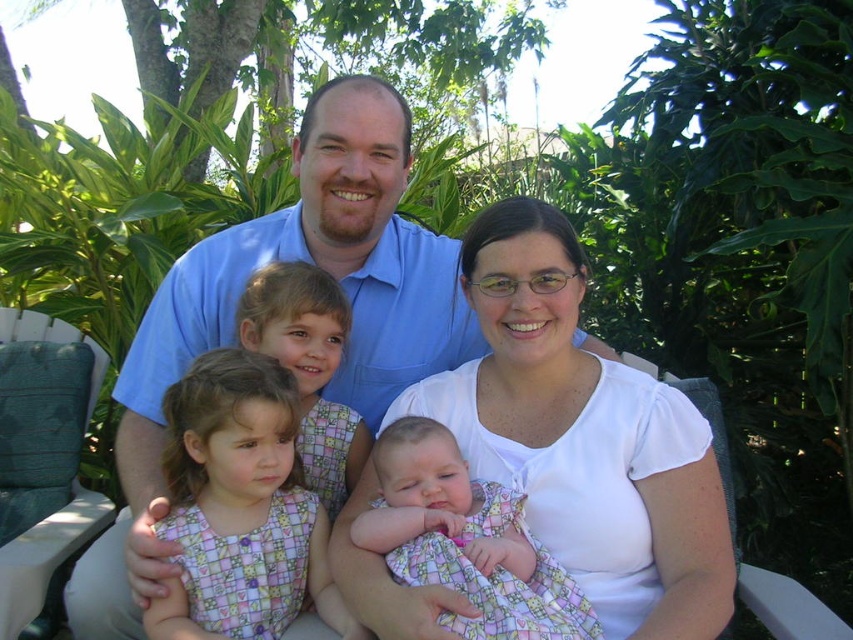
The image shows a family of five seated outdoors. The adults are sitting behind the children. There is a baby in the scene. Where is the floral fabric baby at center located in the image?

The floral fabric baby at center is located at point [465,540] in the image.

You are a photographer setting up for a family portrait. You need to ensure that the white cotton shirt at center and the plaid fabric dress at lower left are both visible in the frame. Based on their widths, which object should you prioritize positioning closer to the center of the frame to ensure visibility?

The white cotton shirt at center might be wider than plaid fabric dress at lower left, so prioritizing the white cotton shirt at center closer to the center of the frame ensures its visibility due to its potential larger width.

You are standing 5 feet away from the white cotton shirt at center. Can you reach it without moving your feet?

The white cotton shirt at center is 4.38 feet away from the viewer. Since you are standing 5 feet away, you cannot reach it without moving closer.